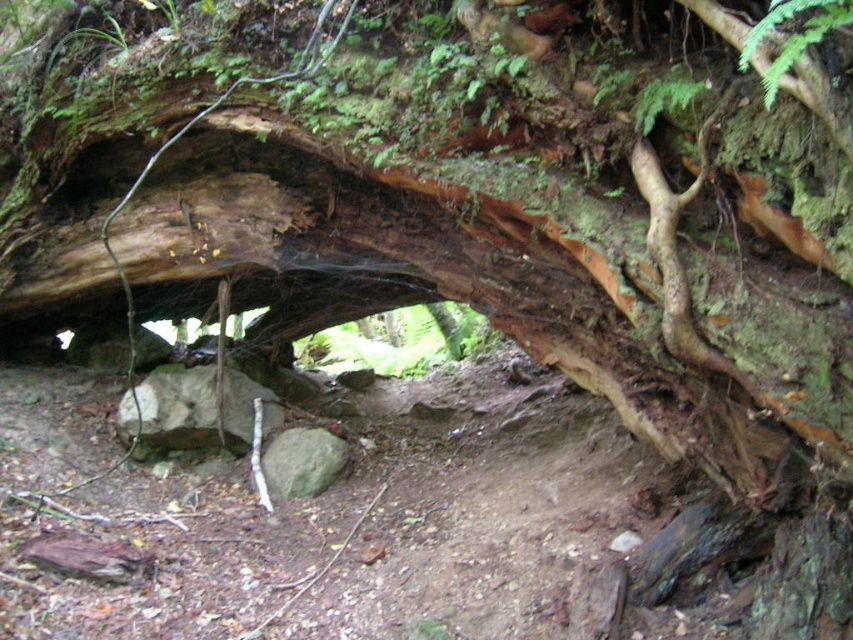
Question: Is gray rock at center smaller than green rough rock at center?

Choices:
 (A) no
 (B) yes

Answer: (A)

Question: In this image, where is gray rock at center located relative to green rough rock at center?

Choices:
 (A) above
 (B) below

Answer: (A)

Question: Among these objects, which one is nearest to the camera?

Choices:
 (A) gray rock at center
 (B) green rough rock at center

Answer: (B)

Question: Is gray rock at center positioned at the back of green rough rock at center?

Choices:
 (A) yes
 (B) no

Answer: (A)